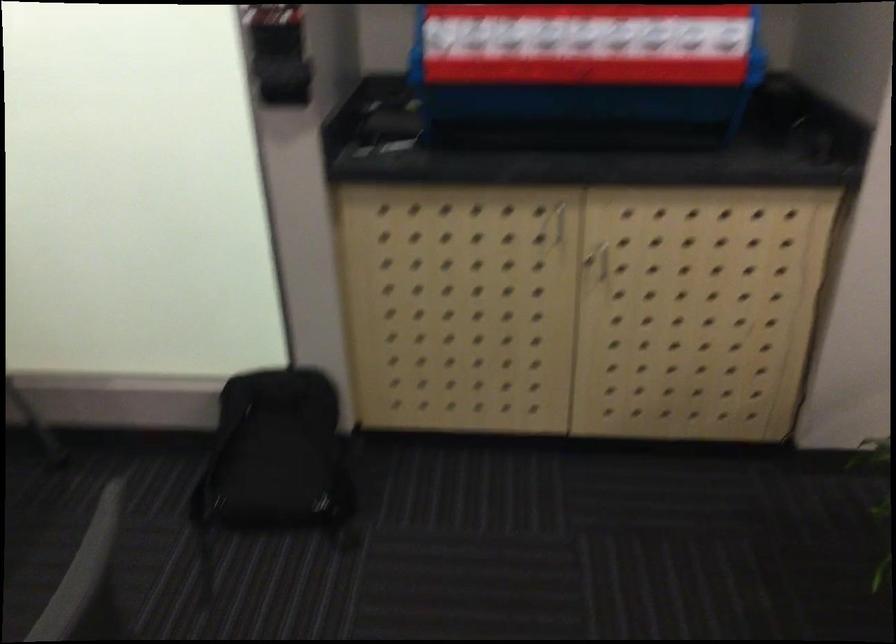
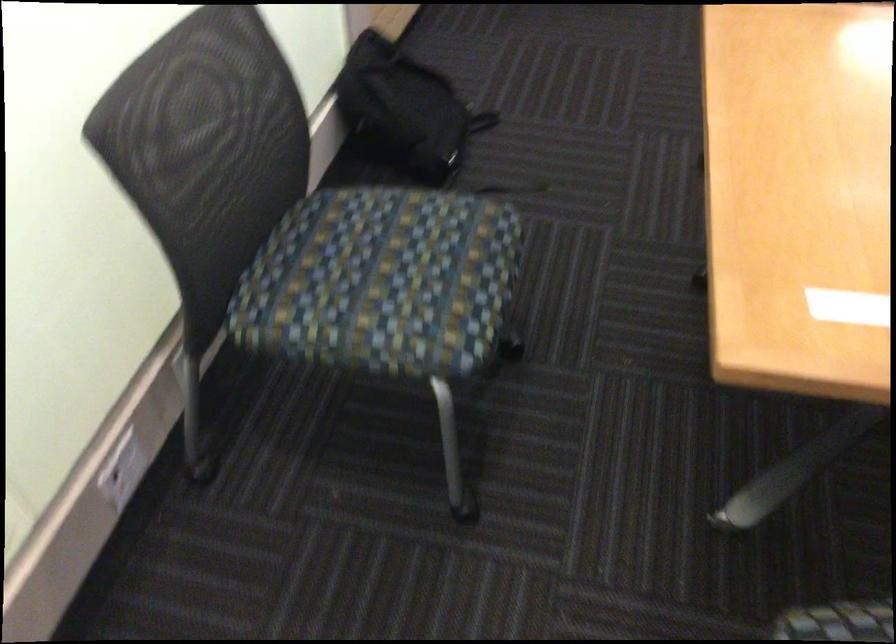
Where in the second image is the point corresponding to point 205,437 from the first image?

(405, 109)